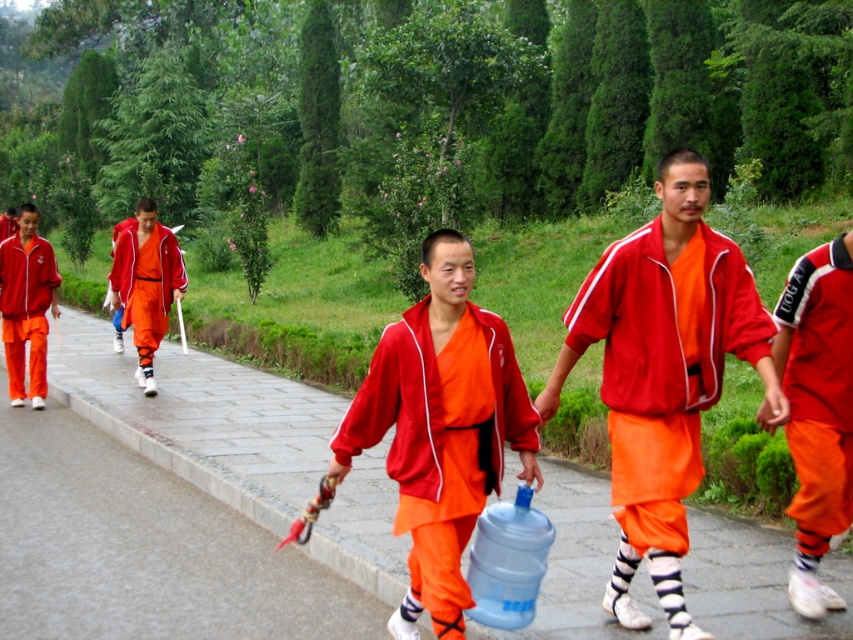
Does matte red jacket at center have a lesser height compared to matte orange fabric at center?

In fact, matte red jacket at center may be taller than matte orange fabric at center.

Measure the distance between matte red jacket at center and camera.

matte red jacket at center and camera are 13.35 feet apart.

Is point (637, 296) positioned in front of point (445, 628)?

No.

The height and width of the screenshot is (640, 853). What are the coordinates of `matte red jacket at center` in the screenshot? It's located at click(x=663, y=372).

Does matte red jacket at center have a greater height compared to matte red tracksuit at left?

No.

Is point (628, 284) farther from camera compared to point (35, 314)?

No.

I want to click on matte red jacket at center, so click(663, 372).

Is matte red tracksuit at right bigger than matte orange robe at center?

Incorrect, matte red tracksuit at right is not larger than matte orange robe at center.

Can you confirm if matte red tracksuit at right is positioned above matte orange robe at center?

No.

Where is `matte red tracksuit at right`? This screenshot has height=640, width=853. matte red tracksuit at right is located at coordinates (817, 388).